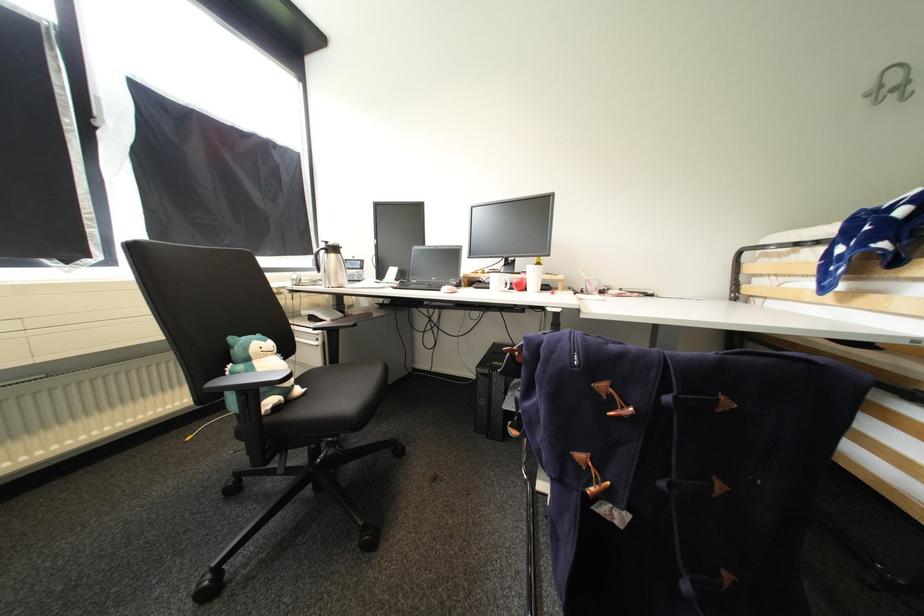
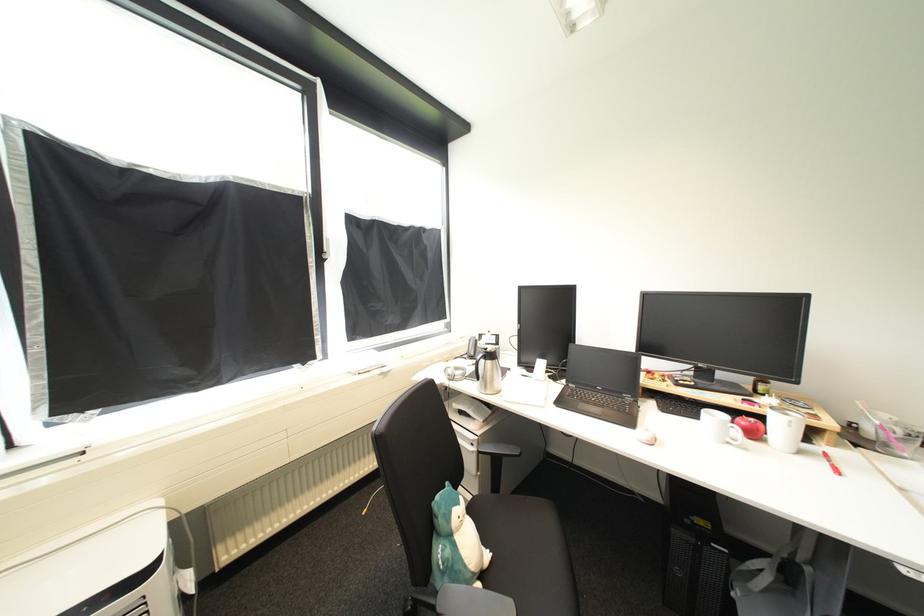
Find the pixel in the second image that matches (x=323, y=346) in the first image.

(480, 453)